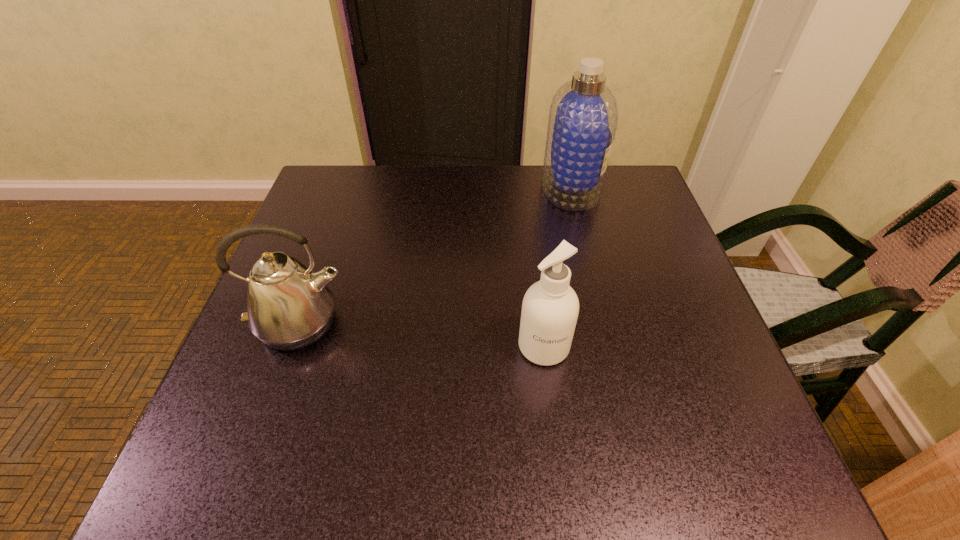
Locate an element on the screen. Image resolution: width=960 pixels, height=540 pixels. object present at the far right corner is located at coordinates (583, 118).

Locate an element on the screen. free region at the far edge of the desktop is located at coordinates (468, 210).

This screenshot has height=540, width=960. Find the location of `vacant space at the near edge`. vacant space at the near edge is located at coordinates (614, 475).

Locate an element on the screen. The image size is (960, 540). blank space at the left edge is located at coordinates (300, 369).

Where is `vacant space at the right edge of the desktop`? This screenshot has height=540, width=960. vacant space at the right edge of the desktop is located at coordinates (656, 268).

The height and width of the screenshot is (540, 960). In the image, there is a desktop. In order to click on vacant space at the far left corner in this screenshot , I will do `click(326, 196)`.

In the image, there is a desktop. At what (x,y) coordinates should I click in order to perform the action: click on blank space at the far right corner. Please return your answer as a coordinate pair (x, y). This screenshot has width=960, height=540. Looking at the image, I should click on (623, 165).

Locate an element on the screen. Image resolution: width=960 pixels, height=540 pixels. free area in between the leftmost object and the nearer cleansing agent is located at coordinates (422, 335).

Where is `free space that is in between the tallest object and the kettle`? free space that is in between the tallest object and the kettle is located at coordinates (436, 255).

Locate an element on the screen. This screenshot has height=540, width=960. vacant area that lies between the farther cleansing agent and the kettle is located at coordinates (436, 255).